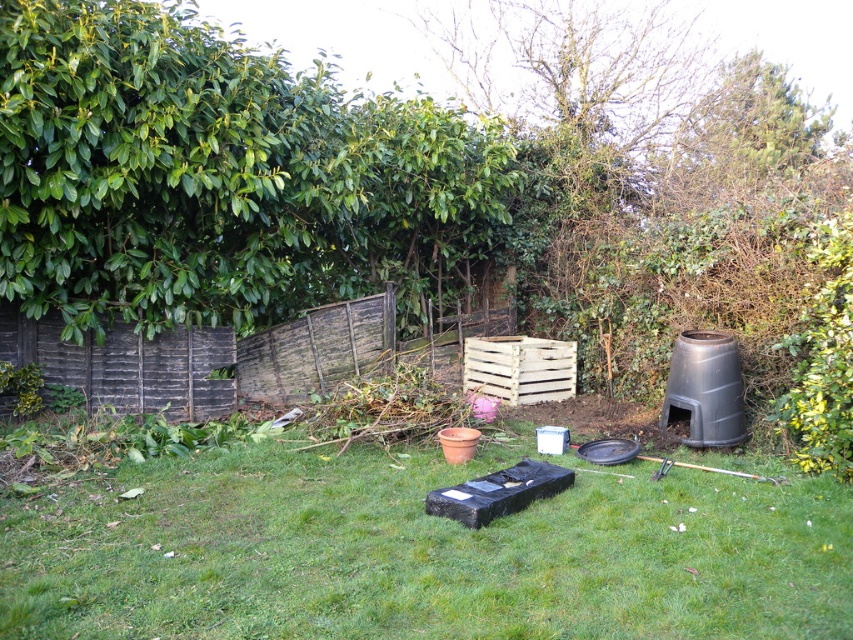
You are a gardener who needs to place a 15 feet long hose between the green grass at center and the weathered wood fence at center. Is there enough space to lay the hose straight between them?

The distance between the green grass at center and the weathered wood fence at center is 14.28 feet, which is shorter than the 15 feet long hose. Therefore, the hose cannot be laid straight between them without bending or shortening.

You are standing in the garden and want to locate the weathered wood fence at center. According to the coordinates provided, where exactly would you find it?

The weathered wood fence at center is located at the coordinates point (207, 358).

You are a gardener who needs to place a new tool shed in the garden. The shed requires a space that is at least as large as the weathered wood fence at center. Can the white wooden crate at center accommodate the shed?

The weathered wood fence at center is larger in size than the white wooden crate at center, so the white wooden crate at center cannot accommodate the shed as it is smaller than the required space.